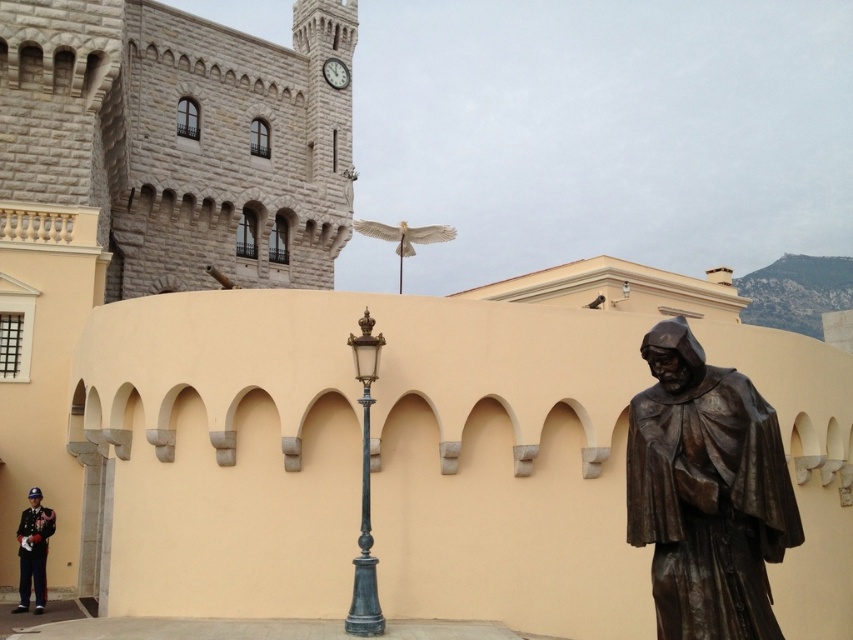
Question: Which point is farther from the camera taking this photo?

Choices:
 (A) (323, 76)
 (B) (21, 561)
 (C) (367, 417)

Answer: (A)

Question: Does bronze statue at right have a greater width compared to shiny black uniform at lower left?

Choices:
 (A) no
 (B) yes

Answer: (A)

Question: Does polished brass streetlamp at center appear on the right side of white stone clock at upper center?

Choices:
 (A) no
 (B) yes

Answer: (B)

Question: Does bronze statue at right have a smaller size compared to shiny black uniform at lower left?

Choices:
 (A) no
 (B) yes

Answer: (B)

Question: Based on their relative distances, which object is farther from the shiny black uniform at lower left?

Choices:
 (A) white stone clock at upper center
 (B) bronze statue at right
 (C) polished brass streetlamp at center

Answer: (A)

Question: Estimate the real-world distances between objects in this image. Which object is farther from the white stone clock at upper center?

Choices:
 (A) bronze statue at right
 (B) polished brass streetlamp at center
 (C) shiny black uniform at lower left

Answer: (A)